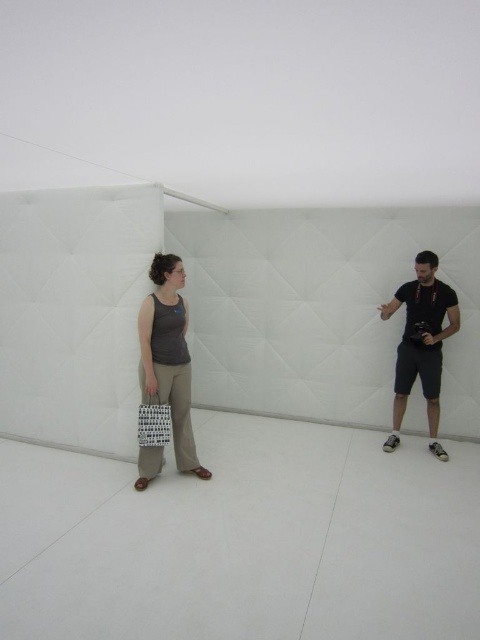
You are a photographer standing 2 meters away from the dark gray fabric camera at right. You want to take a closeup shot of the matte gray tank top at center without moving the camera. Is it possible?

The distance between the matte gray tank top at center and the dark gray fabric camera at right is 1.99 meters. Since you are already 2 meters away from the camera, the total distance from you to the matte gray tank top at center would be approximately 3.99 meters. This distance may be too far for a closeup shot without moving the camera or using specialized equipment.

You are standing in the minimalist room with the two individuals. You want to place a small plant between the two points marked as point (157, 337) and point (159, 440). Based on their positions, will the plant be closer to the person on the right or the left?

Point (157, 337) is behind point (159, 440). Therefore, placing the plant between them would position it closer to the person on the right.

You are standing in the minimalist room and want to move from point A at point (435, 384) to point B at point (162, 420). Which direction should you move to get closer to point B?

To move from point A at point (435, 384) to point B at point (162, 420), you should move downward and to the right because point B is lower and further to the right compared to point A.